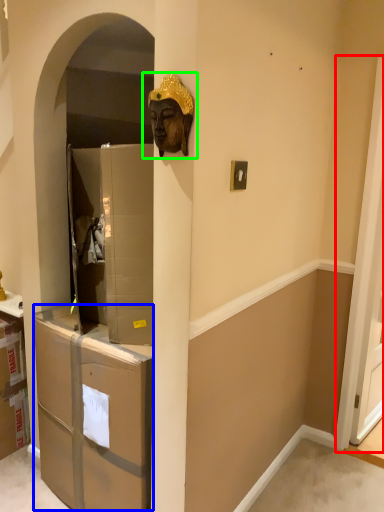
Question: Estimate the real-world distances between objects in this image. Which object is closer to screen door (highlighted by a red box), drawer (highlighted by a blue box) or bronze statue (highlighted by a green box)?

Choices:
 (A) drawer
 (B) bronze statue

Answer: (A)